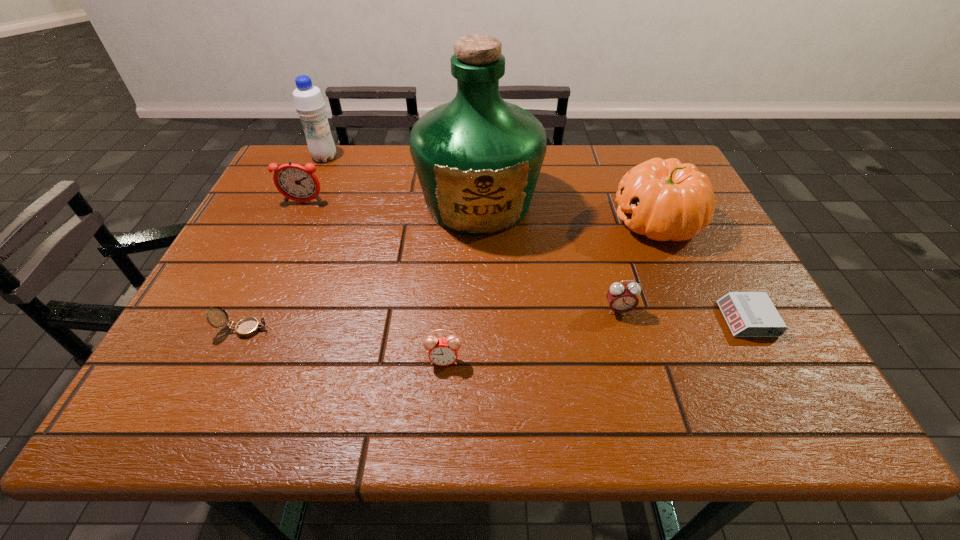
The image size is (960, 540). Identify the location of free spot located 0.220m on the face of the second shortest object. (383, 329).

This screenshot has height=540, width=960. I want to click on free space located on the back of the shortest object, so click(713, 256).

What are the coordinates of `liquor located in the far edge section of the desktop` in the screenshot? It's located at (478, 158).

Locate an element on the screen. The width and height of the screenshot is (960, 540). water bottle at the far edge is located at coordinates (308, 100).

This screenshot has height=540, width=960. What are the coordinates of `water bottle at the left edge` in the screenshot? It's located at (308, 100).

Identify the location of alarm clock present at the left edge. (295, 182).

Find the location of a particular element. Image resolution: width=960 pixels, height=540 pixels. compass at the left edge is located at coordinates (247, 327).

Identify the location of pumpkin located at the right edge. (664, 200).

The image size is (960, 540). I want to click on alarm clock situated at the right edge, so click(x=748, y=314).

The height and width of the screenshot is (540, 960). Identify the location of object present at the far left corner. (308, 100).